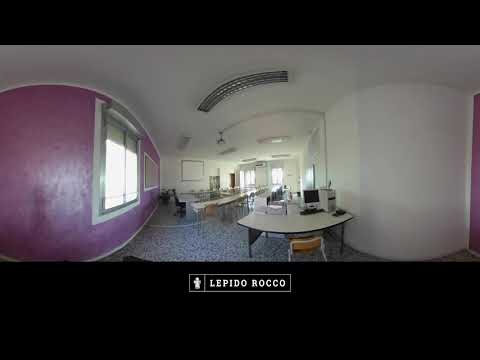
Where is `3 windows`? The width and height of the screenshot is (480, 360). 3 windows is located at coordinates (119, 185), (275, 175), (246, 175).